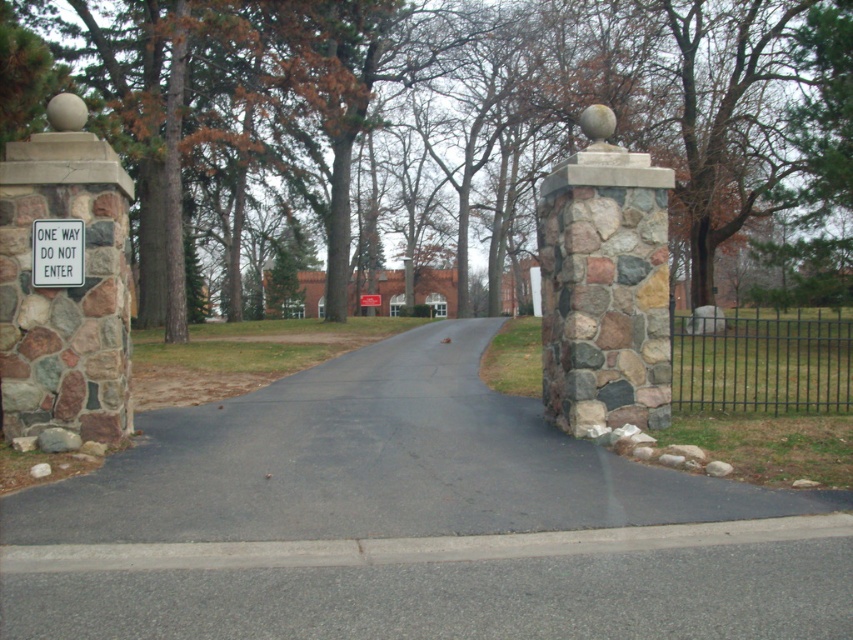
Can you confirm if brown textured tree at upper center is positioned to the right of white paper sign at center?

Indeed, brown textured tree at upper center is positioned on the right side of white paper sign at center.

Describe the element at coordinates (456, 106) in the screenshot. The height and width of the screenshot is (640, 853). I see `brown textured tree at upper center` at that location.

You are a GUI agent. You are given a task and a screenshot of the screen. Output one action in this format:
    pyautogui.click(x=<x>, y=<y>)
    Task: Click on the brown textured tree at upper center
    
    Given the screenshot: What is the action you would take?
    pyautogui.click(x=456, y=106)

How much distance is there between black asphalt road at center and white plastic sign at center?

black asphalt road at center is 2.82 meters from white plastic sign at center.

This screenshot has width=853, height=640. Find the location of `black asphalt road at center`. black asphalt road at center is located at coordinates (374, 464).

You are a GUI agent. You are given a task and a screenshot of the screen. Output one action in this format:
    pyautogui.click(x=<x>, y=<y>)
    Task: Click on the black asphalt road at center
    Image resolution: width=853 pixels, height=640 pixels.
    Given the screenshot: What is the action you would take?
    pyautogui.click(x=374, y=464)

Is black asphalt road at center shorter than white paper sign at center?

Yes.

Is point (119, 516) in front of point (363, 292)?

Yes, point (119, 516) is in front of point (363, 292).

Measure the distance between black asphalt road at center and camera.

They are 5.97 meters apart.

Where is `black asphalt road at center`? The height and width of the screenshot is (640, 853). black asphalt road at center is located at coordinates (x=374, y=464).